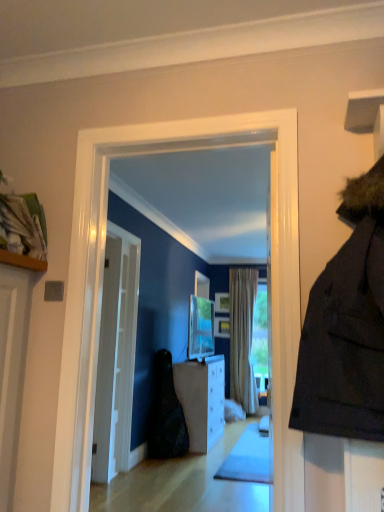
Question: From a real-world perspective, is black fabric bag at center above or below matte silver tv at center?

Choices:
 (A) above
 (B) below

Answer: (B)

Question: Is point (180, 425) closer or farther from the camera than point (200, 298)?

Choices:
 (A) closer
 (B) farther

Answer: (A)

Question: Which object is positioned farthest from the white glossy cabinet at center?

Choices:
 (A) beige fabric curtain at center
 (B) matte silver tv at center
 (C) wooden picture frame at center, the second picture frame in the bottom-to-top sequence
 (D) white glossy door at center
 (E) black fabric bag at center

Answer: (C)

Question: Which object is positioned farthest from the beige fabric curtain at center?

Choices:
 (A) white glossy cabinet at center
 (B) wooden picture frame at center, the 1th picture frame in the top-to-bottom sequence
 (C) wooden picture frame at center, placed as the second picture frame when sorted from top to bottom
 (D) matte silver tv at center
 (E) white glossy door at center

Answer: (E)